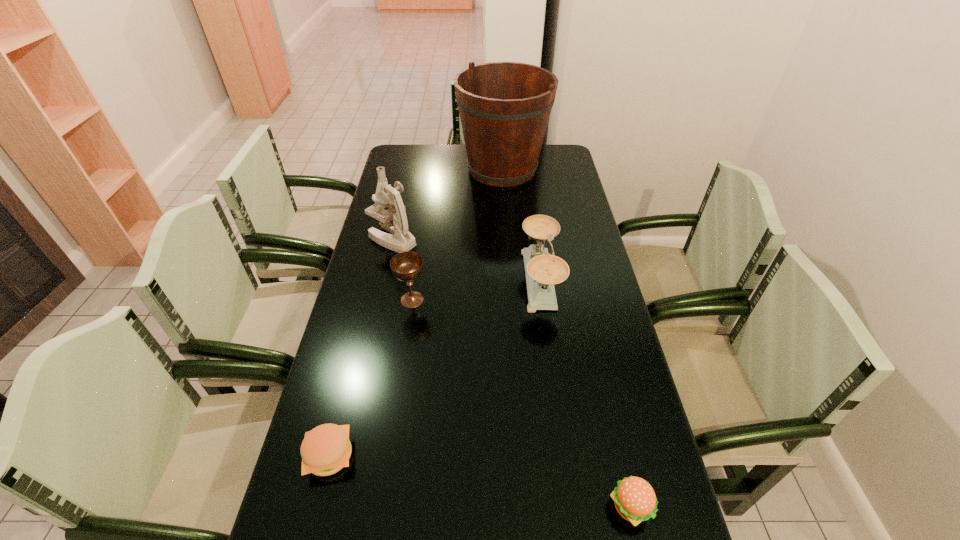
Where is `vacant point located on the back of the microscope`? The image size is (960, 540). vacant point located on the back of the microscope is located at coordinates (404, 186).

Where is `blank space located on the front-facing side of the third tallest object`? This screenshot has width=960, height=540. blank space located on the front-facing side of the third tallest object is located at coordinates (407, 280).

In order to click on vacant space positioned 0.380m on the front-facing side of the third tallest object in this screenshot , I will do `click(401, 280)`.

Locate an element on the screen. Image resolution: width=960 pixels, height=540 pixels. free space located 0.200m on the front-facing side of the third tallest object is located at coordinates 458,280.

At what (x,y) coordinates should I click in order to perform the action: click on free region located 0.190m on the back of the fourth tallest object. Please return your answer as a coordinate pair (x, y). The height and width of the screenshot is (540, 960). Looking at the image, I should click on (420, 249).

Image resolution: width=960 pixels, height=540 pixels. Find the location of `vacant space situated on the right of the farther hamburger`. vacant space situated on the right of the farther hamburger is located at coordinates (418, 456).

Where is `vacant area situated 0.130m on the back of the right hamburger`? This screenshot has height=540, width=960. vacant area situated 0.130m on the back of the right hamburger is located at coordinates (612, 428).

Image resolution: width=960 pixels, height=540 pixels. Find the location of `object positioned at the far edge`. object positioned at the far edge is located at coordinates (504, 107).

You are a GUI agent. You are given a task and a screenshot of the screen. Output one action in this format:
    pyautogui.click(x=<x>, y=<y>)
    Task: Click on the microscope located in the left edge section of the desktop
    
    Given the screenshot: What is the action you would take?
    pyautogui.click(x=394, y=220)

At what (x,y) coordinates should I click in order to perform the action: click on chalice situated at the left edge. Please return your answer as a coordinate pair (x, y). This screenshot has height=540, width=960. Looking at the image, I should click on (407, 266).